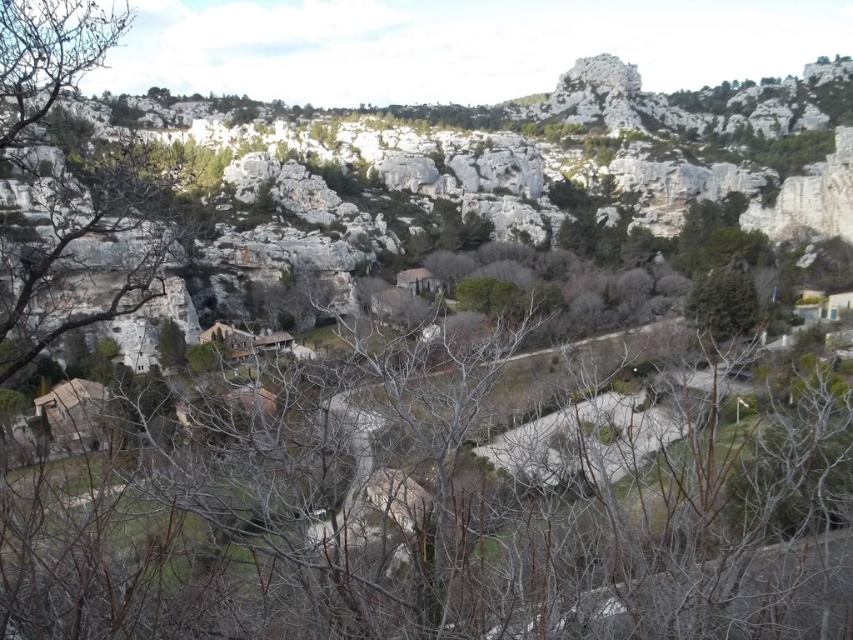
Question: From the image, what is the correct spatial relationship of brown leafless branches at center in relation to green leafy tree at center?

Choices:
 (A) right
 (B) left

Answer: (B)

Question: Which object is farther from the camera taking this photo?

Choices:
 (A) green leafy tree at center
 (B) brown leafless branches at center

Answer: (A)

Question: Is brown leafless branches at center positioned behind green leafy tree at center?

Choices:
 (A) yes
 (B) no

Answer: (B)

Question: Does brown leafless branches at center lie in front of green leafy tree at center?

Choices:
 (A) yes
 (B) no

Answer: (A)